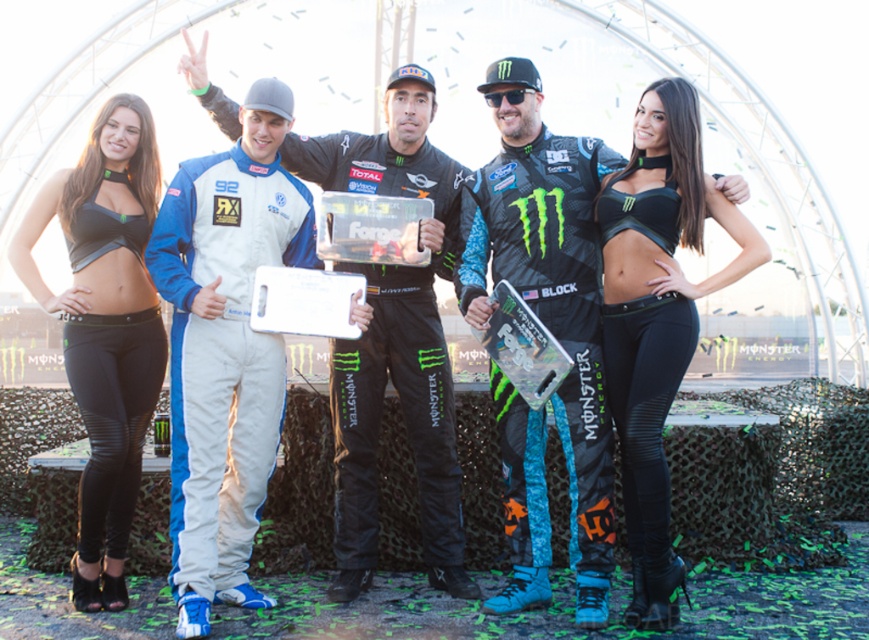
Question: Which point is closer to the camera?

Choices:
 (A) matte black sports bra at left
 (B) black matte sports bra at center

Answer: (B)

Question: Does white fabric racing suit at center come in front of black matte sports bra at center?

Choices:
 (A) yes
 (B) no

Answer: (A)

Question: Is white fabric racing suit at center wider than matte black sports bra at left?

Choices:
 (A) no
 (B) yes

Answer: (B)

Question: Does white fabric racing suit at center appear on the right side of black mesh racing suit at center?

Choices:
 (A) yes
 (B) no

Answer: (B)

Question: Among these points, which one is farthest from the camera?

Choices:
 (A) (635, 497)
 (B) (243, 372)
 (C) (125, 449)
 (D) (513, 424)

Answer: (D)

Question: Which is nearer to the matte black sports bra at left?

Choices:
 (A) black matte sports bra at center
 (B) black mesh racing suit at center
 (C) white fabric racing suit at center

Answer: (C)